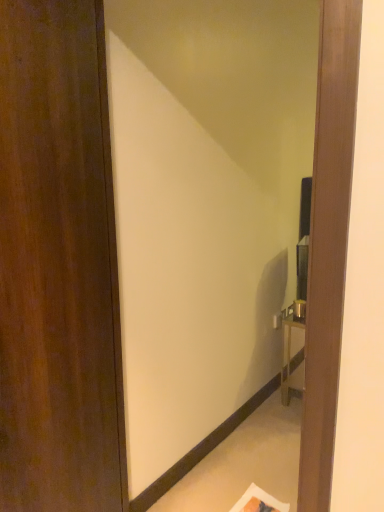
Question: Can we say dark wood door at left lies outside matte wood mirror at center?

Choices:
 (A) no
 (B) yes

Answer: (B)

Question: Considering the relative sizes of dark wood door at left and matte wood mirror at center in the image provided, is dark wood door at left taller than matte wood mirror at center?

Choices:
 (A) yes
 (B) no

Answer: (B)

Question: From a real-world perspective, is dark wood door at left physically below matte wood mirror at center?

Choices:
 (A) yes
 (B) no

Answer: (B)

Question: Does dark wood door at left appear on the right side of matte wood mirror at center?

Choices:
 (A) yes
 (B) no

Answer: (B)

Question: Considering the relative positions of dark wood door at left and matte wood mirror at center in the image provided, is dark wood door at left in front of matte wood mirror at center?

Choices:
 (A) yes
 (B) no

Answer: (A)

Question: Is dark wood door at left facing towards matte wood mirror at center?

Choices:
 (A) no
 (B) yes

Answer: (B)

Question: From a real-world perspective, does matte wood mirror at center sit lower than dark wood door at left?

Choices:
 (A) no
 (B) yes

Answer: (B)

Question: Is dark wood door at left completely or partially inside matte wood mirror at center?

Choices:
 (A) no
 (B) yes

Answer: (A)

Question: Could you tell me if matte wood mirror at center is facing dark wood door at left?

Choices:
 (A) yes
 (B) no

Answer: (A)

Question: Can you confirm if matte wood mirror at center is wider than dark wood door at left?

Choices:
 (A) no
 (B) yes

Answer: (A)

Question: Can you confirm if matte wood mirror at center is thinner than dark wood door at left?

Choices:
 (A) no
 (B) yes

Answer: (B)

Question: Considering the relative sizes of matte wood mirror at center and dark wood door at left in the image provided, is matte wood mirror at center bigger than dark wood door at left?

Choices:
 (A) yes
 (B) no

Answer: (A)

Question: Is matte wood mirror at center bigger or smaller than dark wood door at left?

Choices:
 (A) small
 (B) big

Answer: (B)